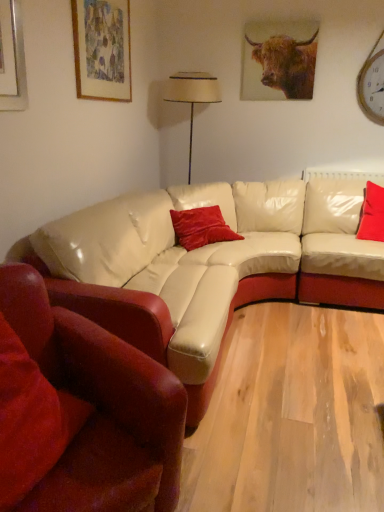
Question: Is velvet red pillow at right, the third pillow when ordered from front to back, further to camera compared to beige fabric lampshade at center?

Choices:
 (A) no
 (B) yes

Answer: (A)

Question: Can you confirm if velvet red pillow at right, the first pillow from the back, is thinner than beige fabric lampshade at center?

Choices:
 (A) no
 (B) yes

Answer: (A)

Question: Considering the relative sizes of velvet red pillow at right, placed as the 3th pillow when sorted from bottom to top, and beige fabric lampshade at center in the image provided, is velvet red pillow at right, placed as the 3th pillow when sorted from bottom to top, wider than beige fabric lampshade at center?

Choices:
 (A) yes
 (B) no

Answer: (A)

Question: Does velvet red pillow at right, placed as the 3th pillow when sorted from bottom to top, appear on the right side of beige fabric lampshade at center?

Choices:
 (A) no
 (B) yes

Answer: (B)

Question: Does velvet red pillow at right, the first pillow from the back, appear on the left side of beige fabric lampshade at center?

Choices:
 (A) yes
 (B) no

Answer: (B)

Question: Does velvet red pillow at right, arranged as the first pillow when viewed from the right, turn towards beige fabric lampshade at center?

Choices:
 (A) no
 (B) yes

Answer: (A)

Question: Is beige fabric lampshade at center turned away from velvet red pillow at right, the first pillow from the back?

Choices:
 (A) yes
 (B) no

Answer: (B)

Question: Is beige fabric lampshade at center at the right side of velvet red pillow at right, the first pillow from the back?

Choices:
 (A) yes
 (B) no

Answer: (B)

Question: Does beige fabric lampshade at center come behind velvet red pillow at right, arranged as the third pillow when viewed from the left?

Choices:
 (A) no
 (B) yes

Answer: (B)

Question: Does beige fabric lampshade at center lie in front of velvet red pillow at right, placed as the 3th pillow when sorted from bottom to top?

Choices:
 (A) yes
 (B) no

Answer: (B)

Question: From the image's perspective, does beige fabric lampshade at center appear lower than velvet red pillow at right, placed as the first pillow when sorted from top to bottom?

Choices:
 (A) no
 (B) yes

Answer: (A)

Question: Considering the relative sizes of beige fabric lampshade at center and velvet red pillow at right, the third pillow when ordered from front to back, in the image provided, is beige fabric lampshade at center shorter than velvet red pillow at right, the third pillow when ordered from front to back,?

Choices:
 (A) yes
 (B) no

Answer: (B)

Question: Can you confirm if velvet red pillow at right, arranged as the third pillow when viewed from the left, is thinner than matte paper picture frame at upper left?

Choices:
 (A) yes
 (B) no

Answer: (B)